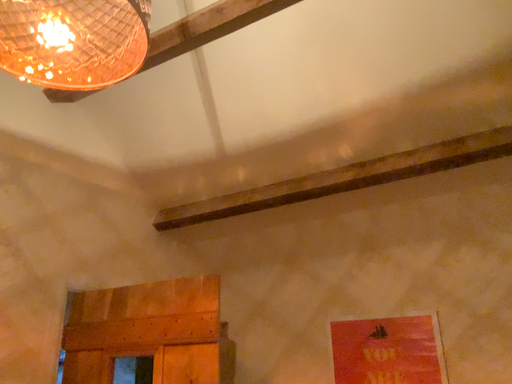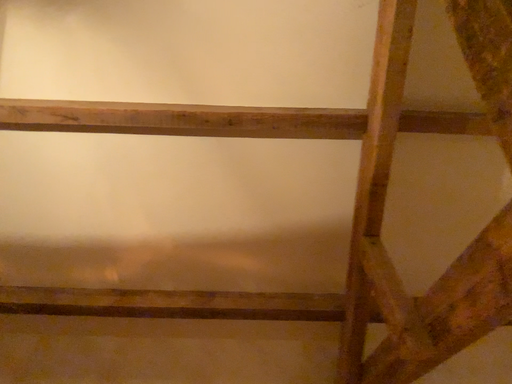
Question: Which way did the camera rotate in the video?

Choices:
 (A) rotated upward
 (B) rotated downward

Answer: (A)